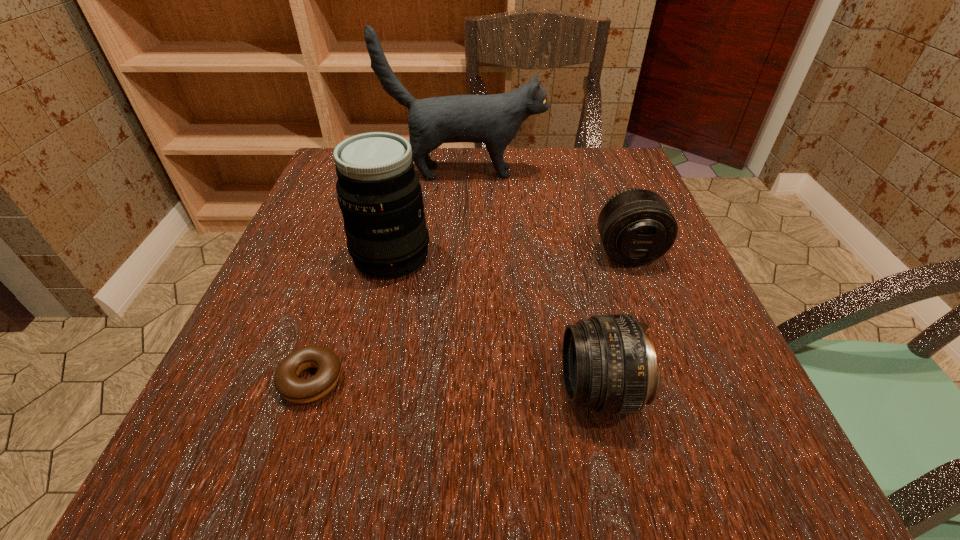
Locate an element on the screen. the farthest object is located at coordinates (495, 119).

I want to click on cat, so click(495, 119).

This screenshot has width=960, height=540. I want to click on the fourth shortest object, so click(379, 193).

What are the coordinates of `the leftmost telephoto lens` in the screenshot? It's located at (379, 193).

At what (x,y) coordinates should I click in order to perform the action: click on the nearest telephoto lens. Please return your answer as a coordinate pair (x, y). The image size is (960, 540). Looking at the image, I should click on (609, 363).

You are a GUI agent. You are given a task and a screenshot of the screen. Output one action in this format:
    pyautogui.click(x=<x>, y=<y>)
    Task: Click on the doughnut
    
    Given the screenshot: What is the action you would take?
    pyautogui.click(x=287, y=382)

At what (x,y) coordinates should I click in order to perform the action: click on free spot located at the face of the cat. Please return your answer as a coordinate pair (x, y). The height and width of the screenshot is (540, 960). Looking at the image, I should click on (610, 172).

The image size is (960, 540). I want to click on vacant region located 0.070m on the front of the second tallest object, so click(378, 312).

I want to click on vacant space situated 0.280m at the front element of the nearest telephoto lens, so click(362, 390).

The height and width of the screenshot is (540, 960). I want to click on free space located 0.050m at the front element of the nearest telephoto lens, so click(x=527, y=390).